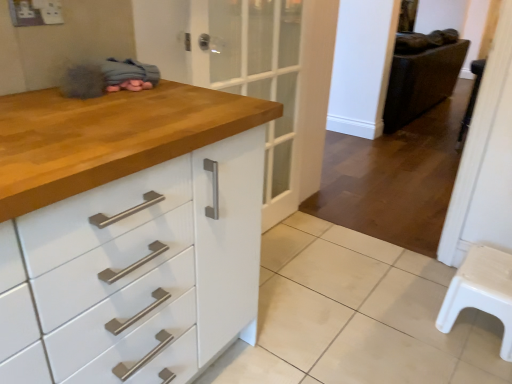
At what (x,y) coordinates should I click in order to perform the action: click on vacant space underneath white plastic stool at lower right (from a real-world perspective). Please return your answer as a coordinate pair (x, y). Looking at the image, I should click on (477, 329).